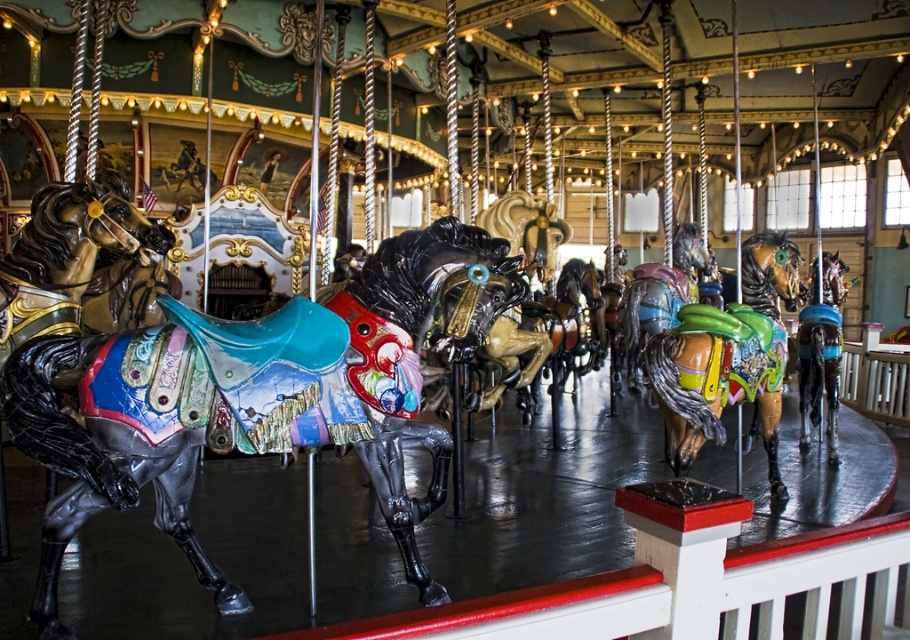
Question: Can you confirm if shiny black horse at center is positioned below shiny brown horse at right?

Choices:
 (A) yes
 (B) no

Answer: (A)

Question: Where is shiny black horse at center located in relation to shiny brown horse at center in the image?

Choices:
 (A) above
 (B) below

Answer: (B)

Question: Does shiny black horse at center have a smaller size compared to shiny brown horse at right?

Choices:
 (A) yes
 (B) no

Answer: (A)

Question: Based on their relative distances, which object is farther from the shiny brown horse at right?

Choices:
 (A) shiny brown horse at center
 (B) shiny black horse at center

Answer: (B)

Question: Which of these objects is positioned closest to the shiny black horse at center?

Choices:
 (A) shiny brown horse at right
 (B) shiny brown horse at center

Answer: (B)

Question: Which object appears closest to the camera in this image?

Choices:
 (A) shiny brown horse at center
 (B) shiny brown horse at right

Answer: (A)